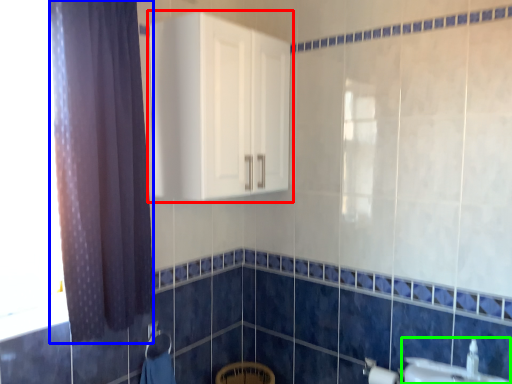
Question: Considering the real-world distances, which object is closest to cabinetry (highlighted by a red box)? curtain (highlighted by a blue box) or sink (highlighted by a green box).

Choices:
 (A) curtain
 (B) sink

Answer: (A)